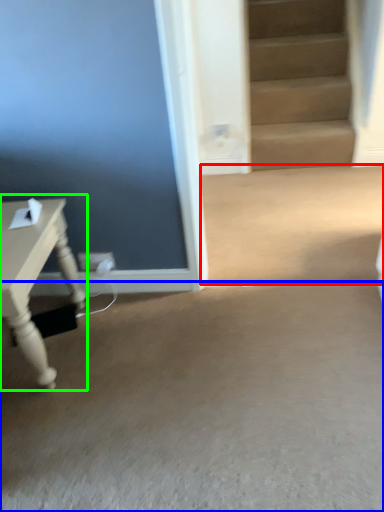
Question: Which is farther away from concrete (highlighted by a red box)? concrete (highlighted by a blue box) or table (highlighted by a green box)?

Choices:
 (A) concrete
 (B) table

Answer: (B)